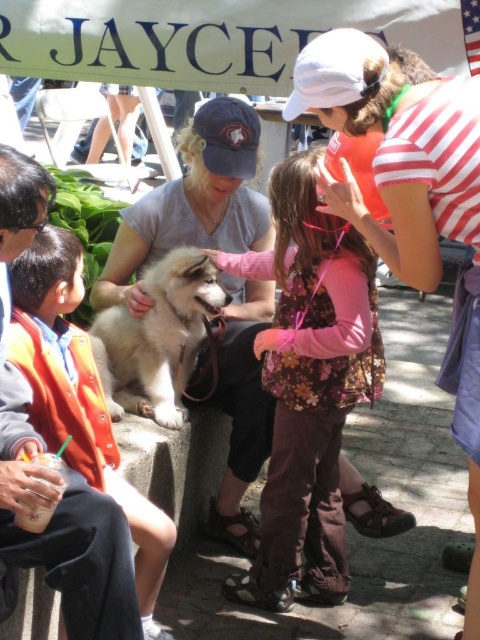
You are standing at the point labeled point (292, 273) and want to walk to the point labeled point (156, 403). Will you be moving forward or backward relative to your current position?

Since point (292, 273) is in front of point (156, 403), moving from point (292, 273) to point (156, 403) would require moving backward relative to your current position.

Where is the floral fabric vest at center located in the image?

The floral fabric vest at center is located at point (309, 387).